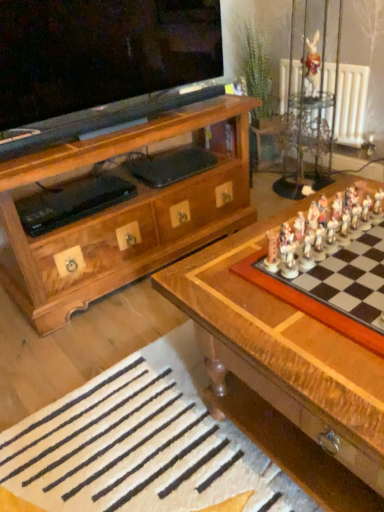
This screenshot has width=384, height=512. What are the coordinates of `vacant space situated on the left part of wooden chessboard at right` in the screenshot? It's located at (240, 292).